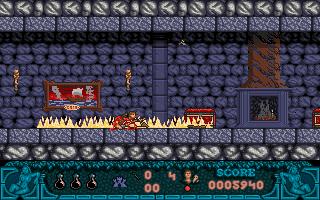
This screenshot has width=320, height=200. Identify the location of wall sconces. (15, 80), (128, 82).